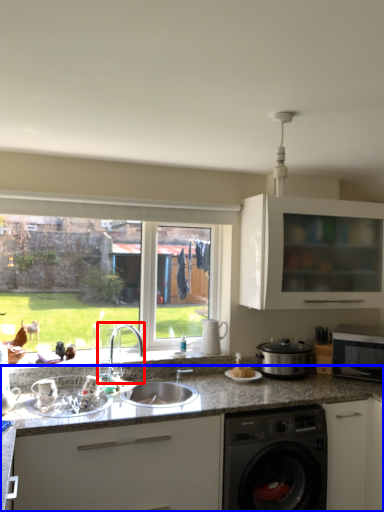
Question: Which object is closer to the camera taking this photo, tap (highlighted by a red box) or countertop (highlighted by a blue box)?

Choices:
 (A) tap
 (B) countertop

Answer: (B)